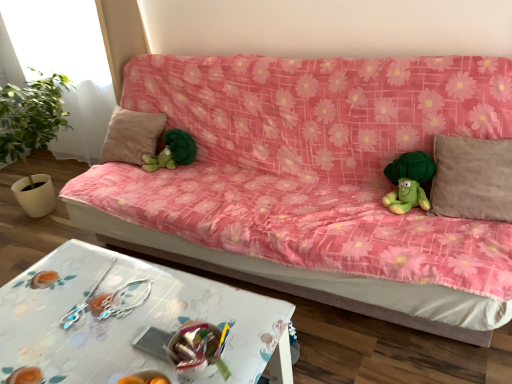
Question: Is transparent glass window at upper left located outside white glossy table at lower center?

Choices:
 (A) no
 (B) yes

Answer: (B)

Question: Does transparent glass window at upper left lie in front of white glossy table at lower center?

Choices:
 (A) yes
 (B) no

Answer: (B)

Question: Is transparent glass window at upper left bigger than white glossy table at lower center?

Choices:
 (A) yes
 (B) no

Answer: (B)

Question: Is transparent glass window at upper left further to the viewer compared to white glossy table at lower center?

Choices:
 (A) no
 (B) yes

Answer: (B)

Question: Can you confirm if transparent glass window at upper left is smaller than white glossy table at lower center?

Choices:
 (A) no
 (B) yes

Answer: (B)

Question: Is silver metallic earrings at lower center wider or thinner than green plush toy at right, the second toy from the left?

Choices:
 (A) wide
 (B) thin

Answer: (B)

Question: Is silver metallic earrings at lower center inside or outside of green plush toy at right, which is the first toy in front-to-back order?

Choices:
 (A) inside
 (B) outside

Answer: (B)

Question: Is silver metallic earrings at lower center in front of or behind green plush toy at right, which is the first toy in front-to-back order, in the image?

Choices:
 (A) front
 (B) behind

Answer: (A)

Question: From a real-world perspective, is silver metallic earrings at lower center physically located above or below green plush toy at right, the second toy from the left?

Choices:
 (A) above
 (B) below

Answer: (B)

Question: From the image's perspective, is silver metallic earrings at lower center positioned above or below beige fabric pillow at center, acting as the 2th pillow starting from the right?

Choices:
 (A) below
 (B) above

Answer: (A)

Question: Visually, is silver metallic earrings at lower center positioned to the left or to the right of beige fabric pillow at center, arranged as the first pillow when viewed from the back?

Choices:
 (A) left
 (B) right

Answer: (B)

Question: Does point (82, 314) appear closer or farther from the camera than point (124, 135)?

Choices:
 (A) closer
 (B) farther

Answer: (A)

Question: From a real-world perspective, relative to beige fabric pillow at center, arranged as the first pillow when viewed from the back, is silver metallic earrings at lower center vertically above or below?

Choices:
 (A) above
 (B) below

Answer: (B)

Question: In the image, is pink floral fabric couch at center on the left side or the right side of beige fabric pillow at center, placed as the first pillow when sorted from left to right?

Choices:
 (A) left
 (B) right

Answer: (B)

Question: Considering the positions of pink floral fabric couch at center and beige fabric pillow at center, arranged as the first pillow when viewed from the back, in the image, is pink floral fabric couch at center wider or thinner than beige fabric pillow at center, arranged as the first pillow when viewed from the back,?

Choices:
 (A) thin
 (B) wide

Answer: (B)